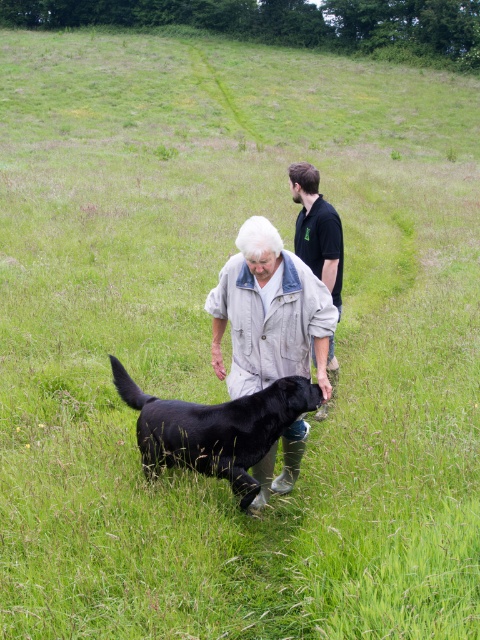
Between point (275, 388) and point (333, 298), which one is positioned in front?

Point (275, 388) is more forward.

Who is lower down, shiny black dog at center or black shirt at center?

Positioned lower is shiny black dog at center.

Image resolution: width=480 pixels, height=640 pixels. I want to click on shiny black dog at center, so click(x=216, y=428).

Is light beige denim jacket at center thinner than black shirt at center?

Incorrect, light beige denim jacket at center's width is not less than black shirt at center's.

What do you see at coordinates (269, 314) in the screenshot? I see `light beige denim jacket at center` at bounding box center [269, 314].

The height and width of the screenshot is (640, 480). Identify the location of light beige denim jacket at center. tap(269, 314).

I want to click on light beige denim jacket at center, so point(269,314).

Does point (243, 372) come in front of point (208, 449)?

No.

Is light beige denim jacket at center shorter than shiny black dog at center?

Incorrect, light beige denim jacket at center's height does not fall short of shiny black dog at center's.

The image size is (480, 640). Find the location of `light beige denim jacket at center`. light beige denim jacket at center is located at coordinates (269, 314).